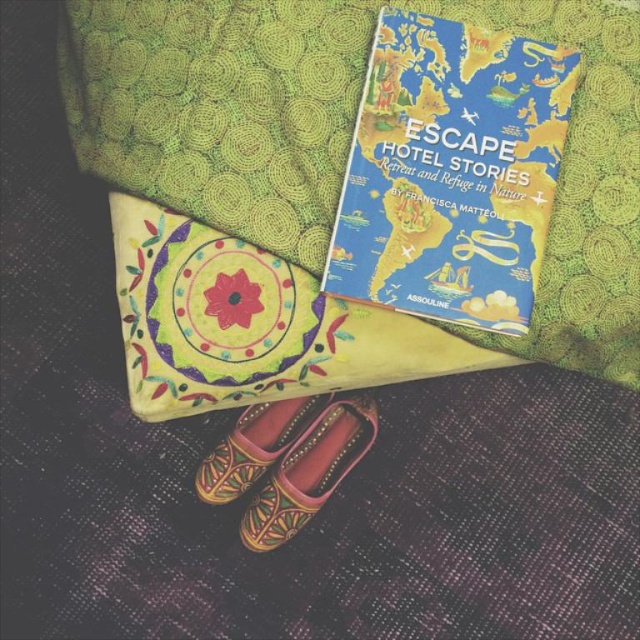
Question: Can you confirm if green textured blanket at upper center is positioned above leather embroidered shoe at lower center?

Choices:
 (A) yes
 (B) no

Answer: (A)

Question: Can you confirm if blue matte book at upper center is positioned below leather textured shoe at lower center?

Choices:
 (A) yes
 (B) no

Answer: (B)

Question: Can you confirm if leather embroidered shoe at lower center is smaller than leather textured shoe at lower center?

Choices:
 (A) yes
 (B) no

Answer: (B)

Question: Which object appears farthest from the camera in this image?

Choices:
 (A) leather textured shoe at lower center
 (B) green textured blanket at upper center
 (C) leather embroidered shoe at lower center
 (D) blue matte book at upper center

Answer: (A)

Question: Among these points, which one is farthest from the camera?

Choices:
 (A) (360, 17)
 (B) (308, 502)
 (C) (237, 486)
 (D) (461, 48)

Answer: (C)

Question: Which is farther from the blue matte book at upper center?

Choices:
 (A) leather embroidered shoe at lower center
 (B) green textured blanket at upper center

Answer: (A)